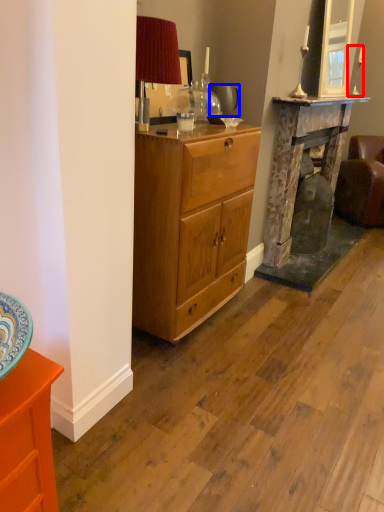
Question: Among these objects, which one is nearest to the camera, candle holder (highlighted by a red box) or teapot (highlighted by a blue box)?

Choices:
 (A) candle holder
 (B) teapot

Answer: (B)